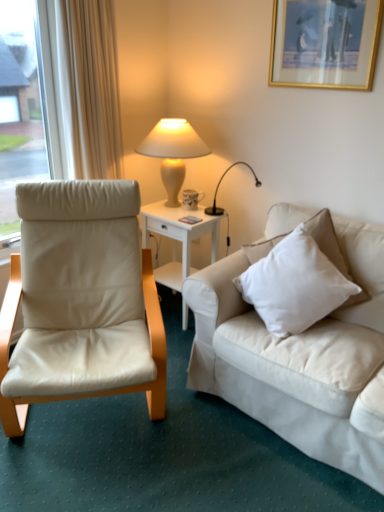
Image resolution: width=384 pixels, height=512 pixels. I want to click on free space underneath beige leather chair at left (from a real-world perspective), so click(89, 421).